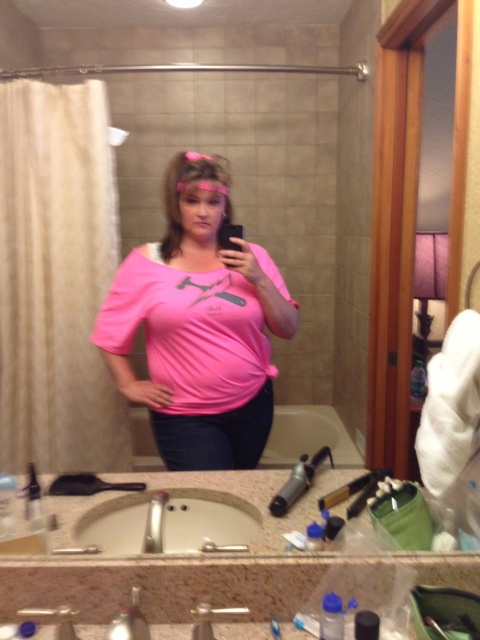
In the bathroom mirror selfie, you notice a point at coordinates (199,326). What object is located exactly at that point?

The pink matte shirt at center is located exactly at point (199,326).

You are trying to place a new toothbrush holder on the countertop in the bathroom. The holder requires a space of 10 cm in width. Can you determine if there is enough space between the white ceramic sink at lower center and the nearest object on its right side?

The position of white ceramic sink at lower center is at point (168, 522). However, without knowing the position of the nearest object on its right side, it is impossible to determine the available space. Please provide more information about the nearest object on the right side of the sink.